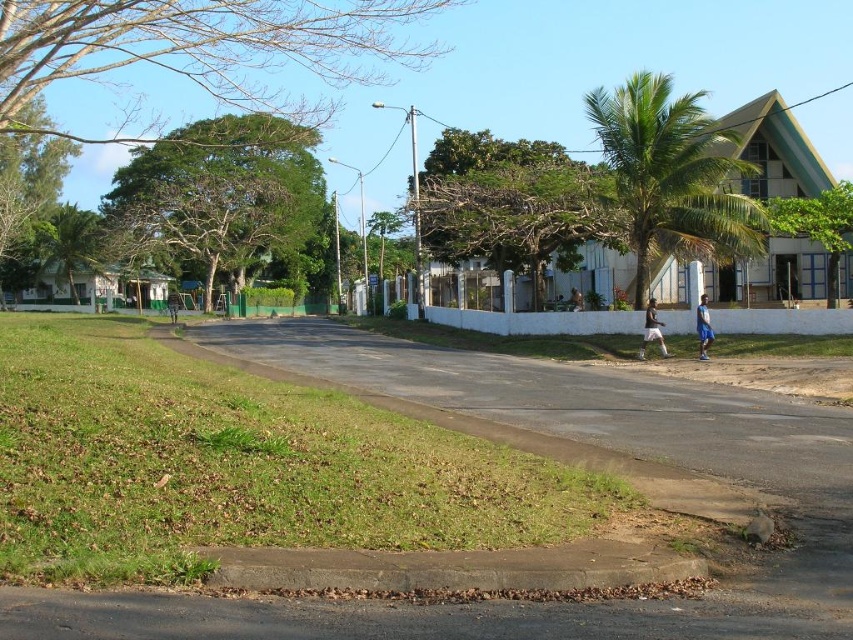
You are a photographer trying to capture the two people in the scene. Since both are wearing shorts, you want to ensure you frame them correctly. Which person wearing white fabric shorts at lower right is positioned to the left of the other person wearing blue fabric shorts at lower right?

A: The white fabric shorts at lower right are positioned to the left of the blue fabric shorts at lower right.

You are standing at the center of the suburban scene and want to locate the white fabric shorts at lower right. According to the coordinates provided, in which direction should you look to find them?

The white fabric shorts at lower right are located at point 0.517 on the x axis and 0.766 on the y axis. Since the coordinates are given as x,y, the lower right position would mean a higher x value and lower y value. However, the y value here is 0.766 which is relatively high. This might indicate that the shorts are positioned more towards the center right rather than the very lower part of the image. To locate them, you should look towards the right side of the image, slightly above the lower edge.

You are standing on the sidewalk in the suburban scene and notice two people. The first person is wearing white fabric and is at the center, while the second person has blue fabric shorts at the lower right. From the perspective of the white fabric person at center, which direction is the blue fabric shorts at lower right located?

The blue fabric shorts at lower right is to the right of the white fabric person at center, so from the white fabric person at center perspective, the blue fabric shorts at lower right is located to their right side.